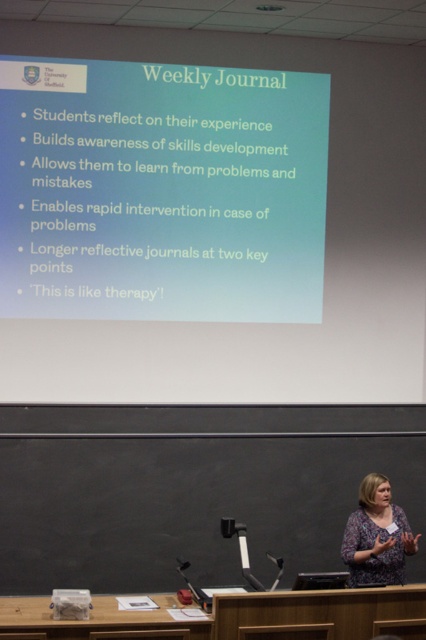
Does white matte projector screen at upper center appear under floral-patterned blouse at lower right?

Incorrect, white matte projector screen at upper center is not positioned below floral-patterned blouse at lower right.

Which is more to the left, white matte projector screen at upper center or floral-patterned blouse at lower right?

Positioned to the left is white matte projector screen at upper center.

The height and width of the screenshot is (640, 426). I want to click on white matte projector screen at upper center, so click(161, 192).

Locate an element on the screen. white matte projector screen at upper center is located at coordinates (161, 192).